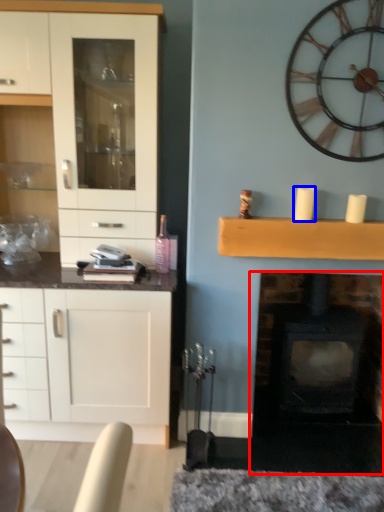
Question: Which point is closer to the camera, fireplace (highlighted by a red box) or candle (highlighted by a blue box)?

Choices:
 (A) fireplace
 (B) candle

Answer: (B)